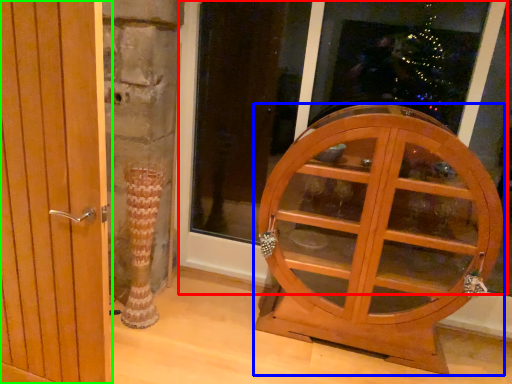
Question: Considering the real-world distances, which object is closest to window frame (highlighted by a red box)? furniture (highlighted by a blue box) or door (highlighted by a green box).

Choices:
 (A) furniture
 (B) door

Answer: (A)